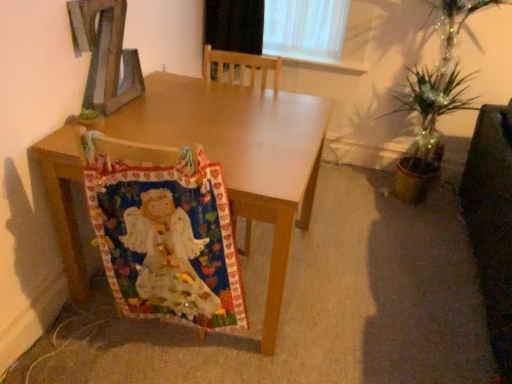
This screenshot has width=512, height=384. I want to click on multicolored fabric at lower left, so click(164, 232).

The width and height of the screenshot is (512, 384). What do you see at coordinates (164, 232) in the screenshot? I see `multicolored fabric at lower left` at bounding box center [164, 232].

Describe the element at coordinates (492, 224) in the screenshot. I see `dark brown leather swivel chair at right` at that location.

The height and width of the screenshot is (384, 512). What are the coordinates of `wooden table at center` in the screenshot? It's located at (241, 154).

Which object is positioned more to the right, dark brown leather swivel chair at right or wooden table at center?

dark brown leather swivel chair at right is more to the right.

Which of these two, dark brown leather swivel chair at right or wooden table at center, is smaller?

dark brown leather swivel chair at right.

In the image, there is a wooden table at center. Where is `swivel chair below it (from the image's perspective)`? swivel chair below it (from the image's perspective) is located at coordinates (492, 224).

You are a GUI agent. You are given a task and a screenshot of the screen. Output one action in this format:
    pyautogui.click(x=<x>, y=<y>)
    Task: Click on the blanket that appears above the dark brown leather swivel chair at right (from the image's perspective)
    
    Given the screenshot: What is the action you would take?
    pyautogui.click(x=164, y=232)

Is there a large distance between multicolored fabric at lower left and dark brown leather swivel chair at right?

Yes, multicolored fabric at lower left is far from dark brown leather swivel chair at right.

Looking at this image, who is smaller, multicolored fabric at lower left or dark brown leather swivel chair at right?

Smaller between the two is multicolored fabric at lower left.

Is dark brown leather swivel chair at right at the back of multicolored fabric at lower left?

That's not correct — multicolored fabric at lower left is not looking away from dark brown leather swivel chair at right.

Can you see wooden letter z at upper left touching dark brown leather swivel chair at right?

No, wooden letter z at upper left is not touching dark brown leather swivel chair at right.

How many degrees apart are the facing directions of wooden letter z at upper left and dark brown leather swivel chair at right?

They differ by 1.06 degrees in their facing directions.

In the image, is wooden letter z at upper left on the left side or the right side of dark brown leather swivel chair at right?

wooden letter z at upper left is positioned on dark brown leather swivel chair at right's left side.

Do you think wooden letter z at upper left is within dark brown leather swivel chair at right, or outside of it?

wooden letter z at upper left cannot be found inside dark brown leather swivel chair at right.

From a real-world perspective, who is located higher, wooden table at center or wooden letter z at upper left?

wooden letter z at upper left, from a real-world perspective.

Who is taller, wooden table at center or wooden letter z at upper left?

With more height is wooden table at center.

Are wooden table at center and wooden letter z at upper left far apart?

wooden table at center is actually quite close to wooden letter z at upper left.

Considering the sizes of objects wooden table at center and wooden letter z at upper left in the image provided, who is wider, wooden table at center or wooden letter z at upper left?

wooden table at center.

Between dark brown leather swivel chair at right and wooden letter z at upper left, which one has larger width?

dark brown leather swivel chair at right.

From the image's perspective, does dark brown leather swivel chair at right appear lower than wooden letter z at upper left?

Indeed, from the image's perspective, dark brown leather swivel chair at right is shown beneath wooden letter z at upper left.

In the image, there is a wooden letter z at upper left. Where is `swivel chair below it (from a real-world perspective)`? The width and height of the screenshot is (512, 384). swivel chair below it (from a real-world perspective) is located at coordinates (492, 224).

Can you tell me how much wooden table at center and multicolored fabric at lower left differ in facing direction?

The angle between the facing direction of wooden table at center and the facing direction of multicolored fabric at lower left is 90.7 degrees.

Is wooden table at center facing towards multicolored fabric at lower left?

No.

In terms of size, does wooden table at center appear bigger or smaller than multicolored fabric at lower left?

In the image, wooden table at center appears to be larger than multicolored fabric at lower left.

Based on the photo, considering the positions of objects wooden table at center and multicolored fabric at lower left in the image provided, who is more to the left, wooden table at center or multicolored fabric at lower left?

multicolored fabric at lower left.

Would you say wooden table at center is part of multicolored fabric at lower left's contents?

No, wooden table at center is not a part of multicolored fabric at lower left.

Is multicolored fabric at lower left taller or shorter than wooden table at center?

multicolored fabric at lower left is taller than wooden table at center.

Does multicolored fabric at lower left turn towards wooden table at center?

Yes, multicolored fabric at lower left is turned towards wooden table at center.

In the image, is multicolored fabric at lower left positioned in front of or behind wooden table at center?

multicolored fabric at lower left is positioned closer to the viewer than wooden table at center.

Image resolution: width=512 pixels, height=384 pixels. I want to click on swivel chair lying below the wooden table at center (from the image's perspective), so click(x=492, y=224).

Where is `blanket above the dark brown leather swivel chair at right (from the image's perspective)`? The width and height of the screenshot is (512, 384). blanket above the dark brown leather swivel chair at right (from the image's perspective) is located at coordinates (164, 232).

Estimate the real-world distances between objects in this image. Which object is further from multicolored fabric at lower left, dark brown leather swivel chair at right or wooden table at center?

dark brown leather swivel chair at right lies further to multicolored fabric at lower left than the other object.

Which object lies further to the anchor point dark brown leather swivel chair at right, multicolored fabric at lower left or wooden table at center?

multicolored fabric at lower left lies further to dark brown leather swivel chair at right than the other object.

Which object lies further to the anchor point wooden table at center, multicolored fabric at lower left or wooden letter z at upper left?

wooden letter z at upper left lies further to wooden table at center than the other object.

Considering their positions, is wooden letter z at upper left positioned further to dark brown leather swivel chair at right than wooden table at center?

The object further to dark brown leather swivel chair at right is wooden letter z at upper left.

Which object lies further to the anchor point wooden table at center, wooden letter z at upper left or multicolored fabric at lower left?

Among the two, wooden letter z at upper left is located further to wooden table at center.

When comparing their distances from wooden table at center, does multicolored fabric at lower left or dark brown leather swivel chair at right seem further?

dark brown leather swivel chair at right lies further to wooden table at center than the other object.

When comparing their distances from multicolored fabric at lower left, does wooden table at center or wooden letter z at upper left seem closer?

wooden table at center.

Looking at the image, which one is located further to dark brown leather swivel chair at right, wooden table at center or multicolored fabric at lower left?

multicolored fabric at lower left is positioned further to the anchor dark brown leather swivel chair at right.

Where is `blanket located between wooden letter z at upper left and dark brown leather swivel chair at right in the left-right direction`? This screenshot has height=384, width=512. blanket located between wooden letter z at upper left and dark brown leather swivel chair at right in the left-right direction is located at coordinates (164, 232).

The image size is (512, 384). In order to click on table between wooden letter z at upper left and multicolored fabric at lower left from top to bottom in this screenshot , I will do `click(241, 154)`.

Where is `table between multicolored fabric at lower left and dark brown leather swivel chair at right`? Image resolution: width=512 pixels, height=384 pixels. table between multicolored fabric at lower left and dark brown leather swivel chair at right is located at coordinates (241, 154).

The image size is (512, 384). I want to click on table between wooden letter z at upper left and dark brown leather swivel chair at right from left to right, so click(x=241, y=154).